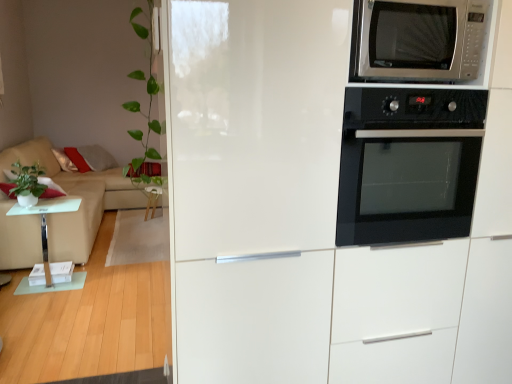
Locate an element on the screen. free space above black glass oven at upper right (from a real-world perspective) is located at coordinates (420, 86).